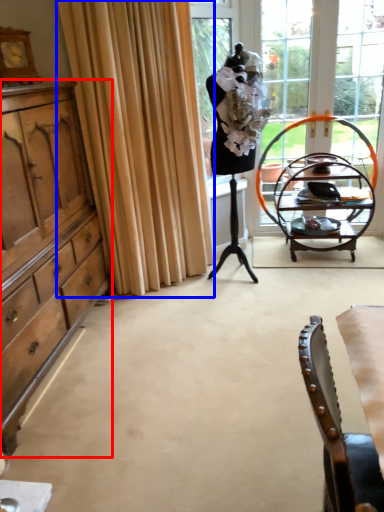
Question: Which of the following is the closest to the observer, cabinetry (highlighted by a red box) or curtain (highlighted by a blue box)?

Choices:
 (A) cabinetry
 (B) curtain

Answer: (A)